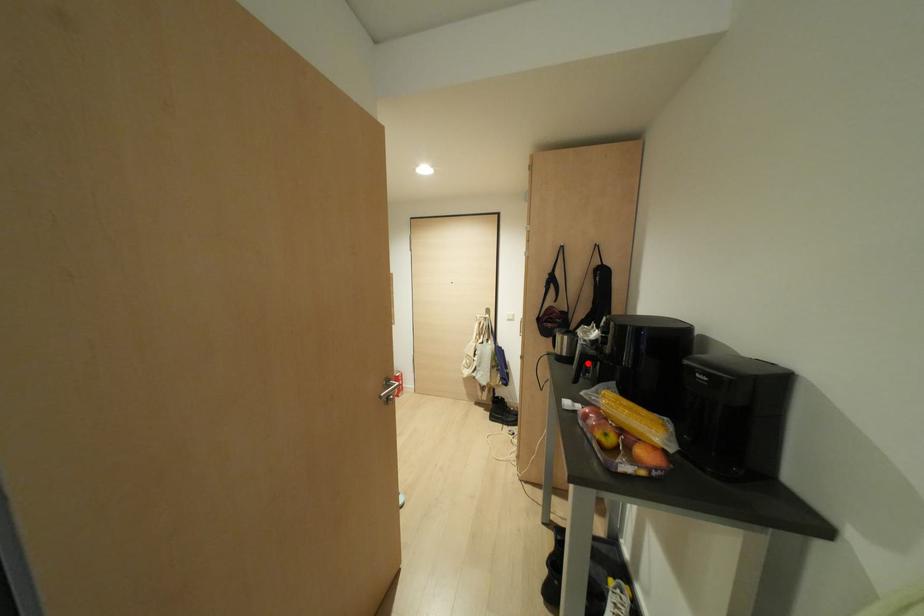
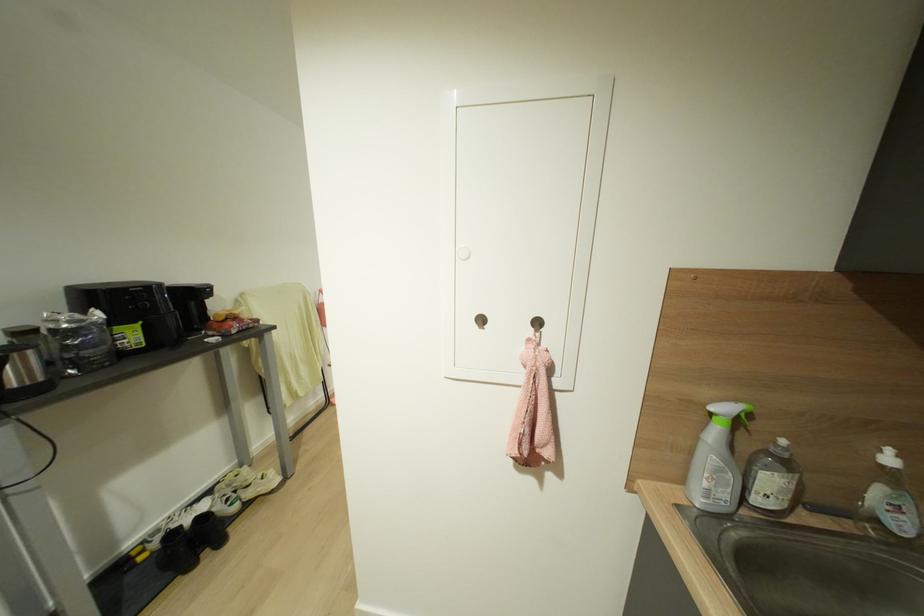
Question: I am providing you with two images of the same scene from different viewpoints. A red point is marked on the first image. Is the red point's position out of view in image 2?

Choices:
 (A) Yes
 (B) No

Answer: (A)